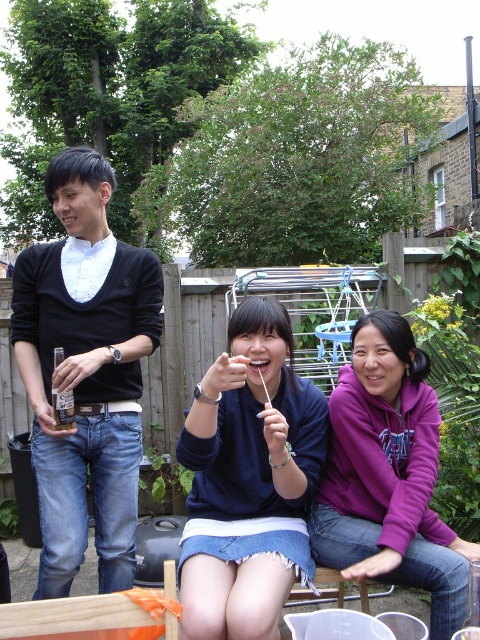
You are a photographer trying to capture a candid shot of the two people at the center of the scene. Since you want to frame them properly, you need to know their positions relative to each other. Which of the two items, the dark blue sweater at center or the purple fleece at center, is positioned to the left?

The dark blue sweater at center is to the left of the purple fleece at center.

You are taking a photo of two points in the image. The first point is at coordinate point (31, 259) and the second point is at coordinate point (374, 461). Which point is closer to the camera?

Point (31, 259) is closer to the camera than point (374, 461) because it is further to the camera than the latter.

You are a photographer trying to capture the group on the wooden bench. You want to ensure that both the dark blue sweater at center and the purple fleece at center are clearly visible in the photo. Based on their positions, which clothing item is covering part of the other?

The dark blue sweater at center is positioned over the purple fleece at center, so it is covering part of the purple fleece at center.